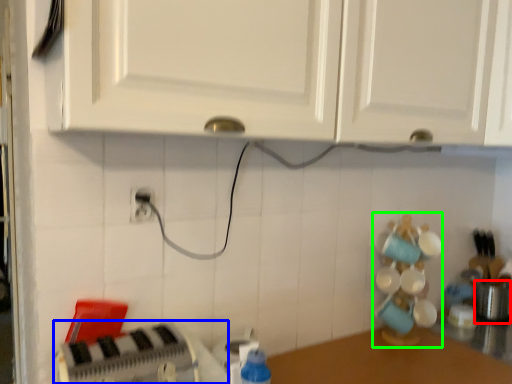
Question: Which is nearer to the appliance (highlighted by a red box)? appliance (highlighted by a blue box) or toy (highlighted by a green box).

Choices:
 (A) appliance
 (B) toy

Answer: (B)